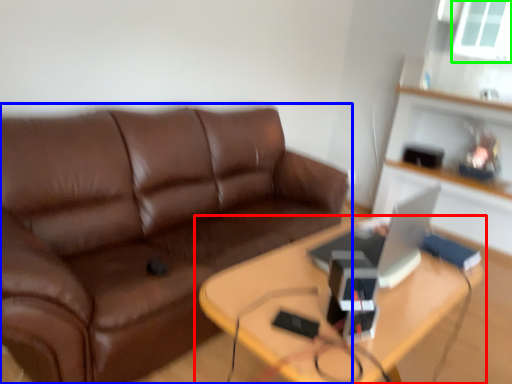
Question: Based on their relative distances, which object is farther from table (highlighted by a red box)? Choose from studio couch (highlighted by a blue box) and window screen (highlighted by a green box).

Choices:
 (A) studio couch
 (B) window screen

Answer: (B)